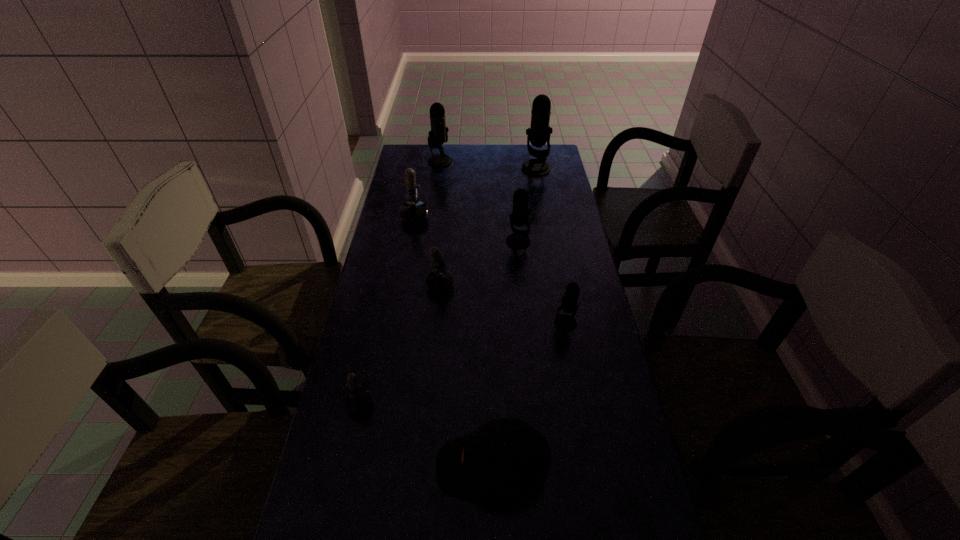
Find the location of a particular element. This screenshot has height=540, width=960. the smallest black microphone is located at coordinates (564, 322).

At what (x,y) coordinates should I click in order to perform the action: click on the third nearest object. Please return your answer as a coordinate pair (x, y). This screenshot has width=960, height=540. Looking at the image, I should click on (564, 322).

Where is `gray baseball cap`? The width and height of the screenshot is (960, 540). gray baseball cap is located at coordinates (505, 459).

Identify the location of baseball cap. (505, 459).

The image size is (960, 540). Find the location of `the shortest microphone`. the shortest microphone is located at coordinates (358, 400).

Find the location of a particular element. Image resolution: width=960 pixels, height=540 pixels. the smallest white microphone is located at coordinates (358, 400).

This screenshot has width=960, height=540. I want to click on blank space located 0.280m on the front of the tallest microphone, so click(x=544, y=216).

Where is `vacant area located 0.120m on the right of the third smallest black microphone`? vacant area located 0.120m on the right of the third smallest black microphone is located at coordinates (479, 161).

Where is `free region located 0.220m on the back of the fourth farthest object`? This screenshot has height=540, width=960. free region located 0.220m on the back of the fourth farthest object is located at coordinates (515, 200).

Where is `free space located on the back of the farthest white microphone`? This screenshot has height=540, width=960. free space located on the back of the farthest white microphone is located at coordinates (426, 151).